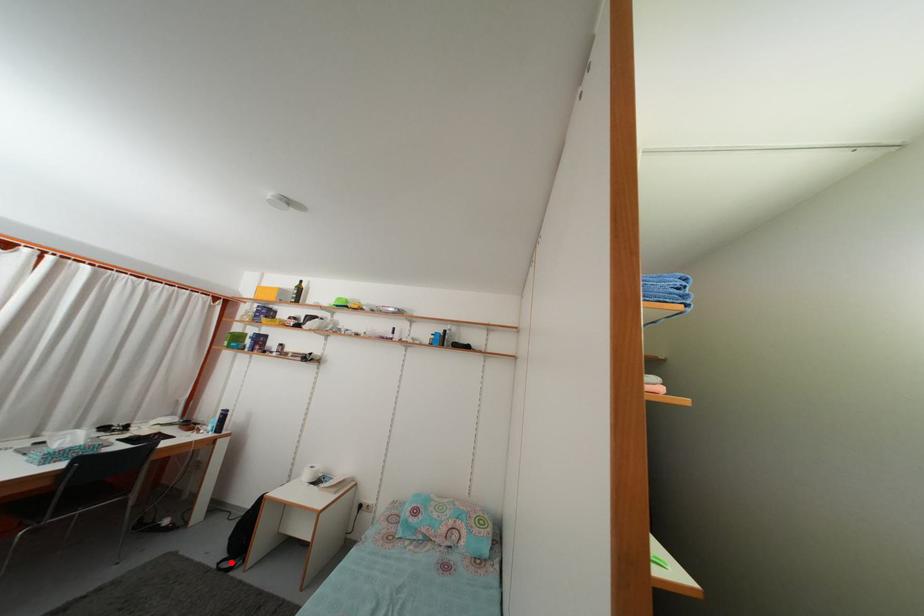
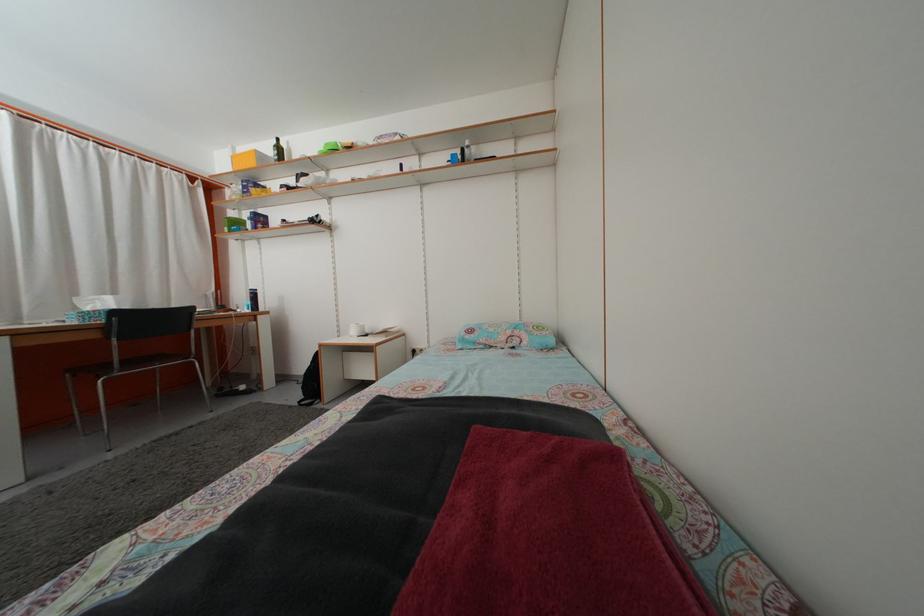
Find the pixel in the second image that matches the highlighted location in the first image.

(309, 405)